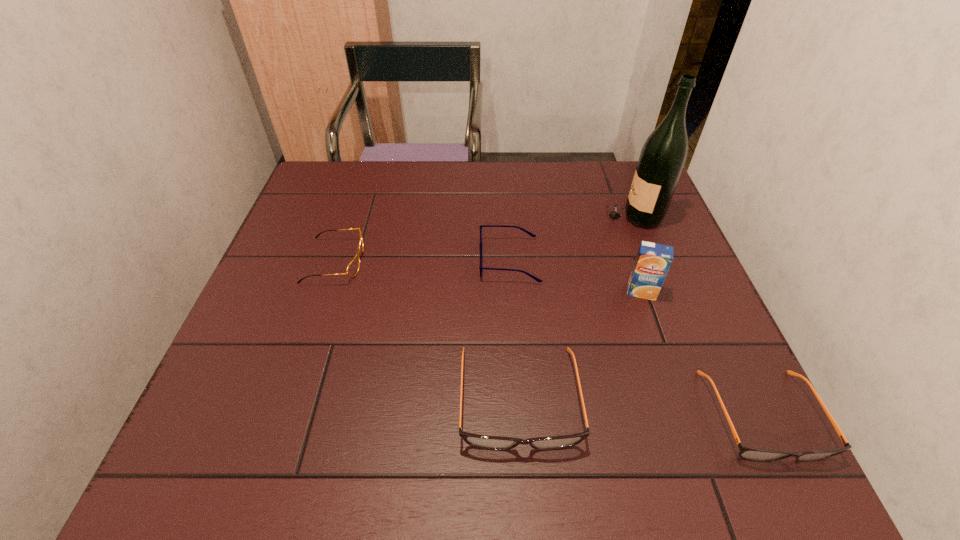
At what (x,y) coordinates should I click in order to perform the action: click on object at the left edge. Please return your answer as a coordinate pair (x, y). The height and width of the screenshot is (540, 960). Looking at the image, I should click on (352, 269).

What are the coordinates of `spectacles that is at the right edge` in the screenshot? It's located at (750, 453).

Locate an element on the screen. The image size is (960, 540). orange_juice located at the right edge is located at coordinates (653, 260).

Locate an element on the screen. This screenshot has width=960, height=540. wine bottle present at the right edge is located at coordinates (662, 158).

Where is `object that is at the far right corner`? The width and height of the screenshot is (960, 540). object that is at the far right corner is located at coordinates (662, 158).

Find the location of a particular element. This screenshot has height=540, width=960. object that is at the near right corner is located at coordinates (750, 453).

The height and width of the screenshot is (540, 960). Identify the location of vacant point at the far edge. (509, 161).

At what (x,y) coordinates should I click in order to perform the action: click on blank space at the near edge of the desktop. Please return your answer as a coordinate pair (x, y). Looking at the image, I should click on (616, 402).

Image resolution: width=960 pixels, height=540 pixels. I want to click on vacant region at the left edge of the desktop, so click(327, 289).

Where is `empty space between the rightmost spectacles and the tallest spectacles`? empty space between the rightmost spectacles and the tallest spectacles is located at coordinates (640, 407).